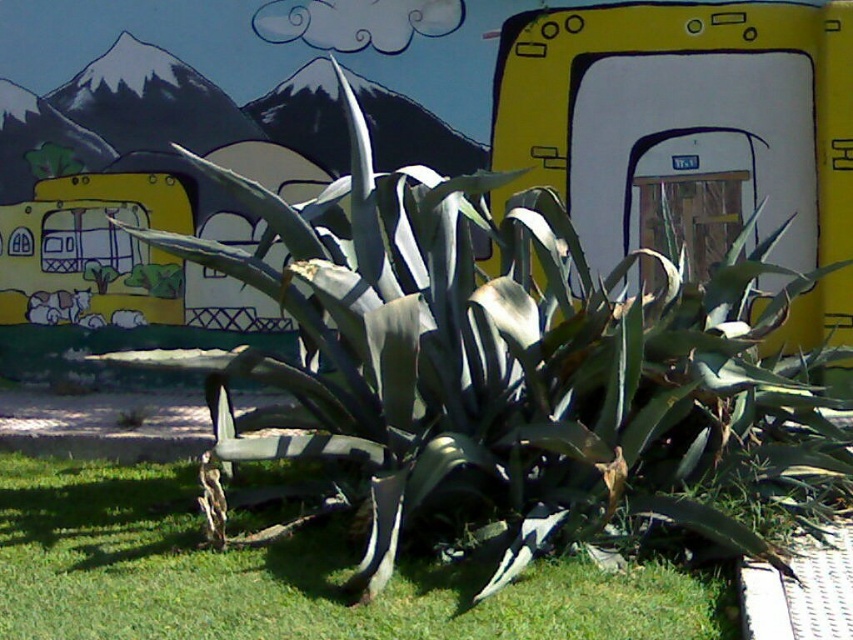
You are a photographer standing in the scene and want to capture both the green grass at lower center and the yellow matte school bus at left in a single frame. Which object should you position closer to the edge of the frame to ensure both fit?

Since the green grass at lower center is wider than the yellow matte school bus at left, you should position the yellow matte school bus at left closer to the edge of the frame to ensure both fit within the frame.

Based on the photo, you are a child standing in the green grass at lower center and want to see the yellow matte school bus at left. Which direction should you look to see it?

The green grass at lower center is in front of the yellow matte school bus at left, so you should look towards the left to see the yellow matte school bus at left.

You are standing in the outdoor scene and want to place a small potted plant exactly at the point marked by coordinates point (282, 576). According to the scene description, what is currently located at that point?

The point (282, 576) corresponds to green grass at lower center, so placing the potted plant there would be on the green grass at lower center.